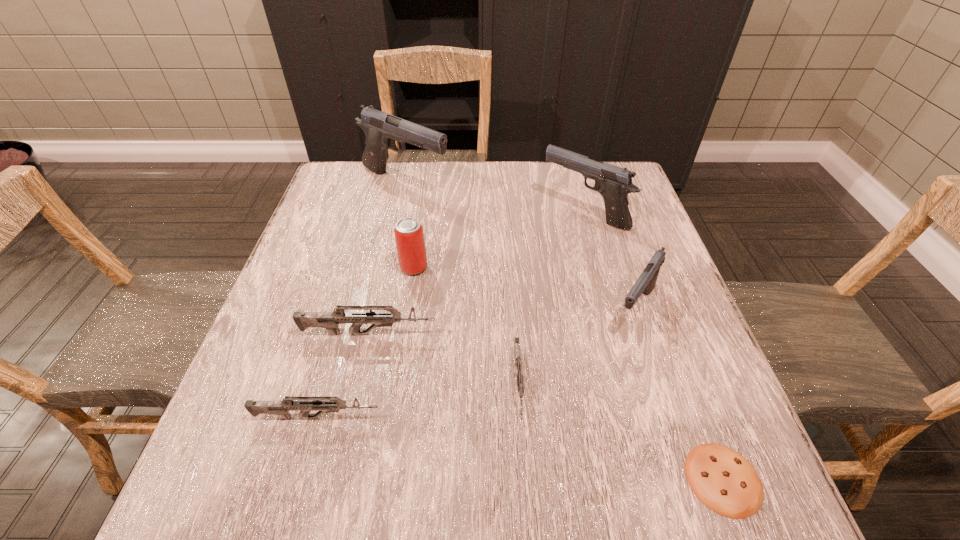
Identify the location of the second smallest grey gun. Image resolution: width=960 pixels, height=540 pixels. (281, 408).

The image size is (960, 540). Identify the location of the second shortest gun. (281, 408).

Where is `the smallest grey gun`? Image resolution: width=960 pixels, height=540 pixels. the smallest grey gun is located at coordinates (516, 341).

Locate an element on the screen. The height and width of the screenshot is (540, 960). the second shortest object is located at coordinates (516, 341).

What are the coordinates of `the shortest object` in the screenshot? It's located at (726, 482).

The image size is (960, 540). What are the coordinates of `cookie` in the screenshot? It's located at 726,482.

Locate an element on the screen. This screenshot has height=540, width=960. vacant space located 0.070m at the muzzle of the tallest gun is located at coordinates pos(476,183).

Image resolution: width=960 pixels, height=540 pixels. In order to click on free space located 0.330m at the muzzle of the second tallest object in this screenshot , I will do `click(419, 212)`.

Find the location of `free region located 0.270m at the muzzle of the second tallest object`. free region located 0.270m at the muzzle of the second tallest object is located at coordinates (442, 212).

The width and height of the screenshot is (960, 540). Identify the location of vacant space located at the muzzle of the second tallest object. (448, 212).